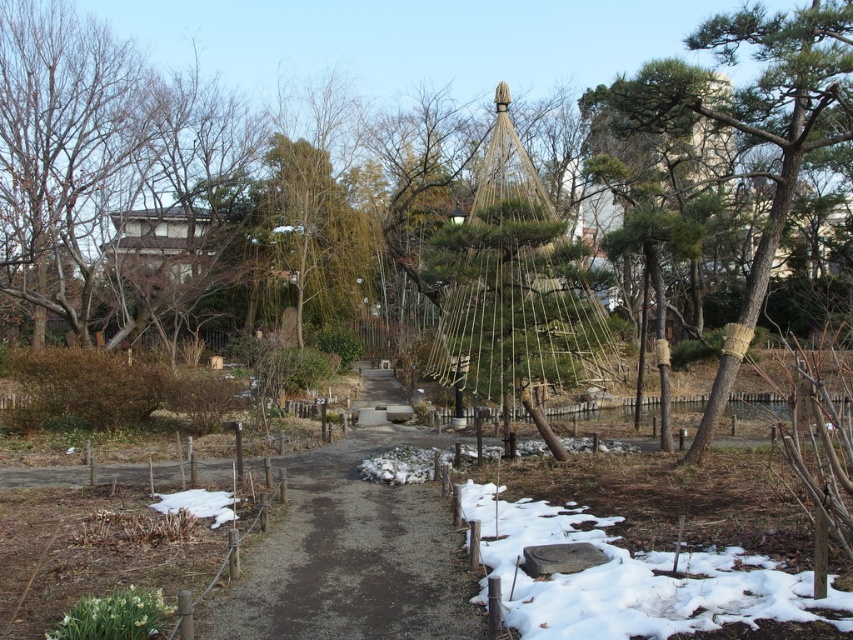
This screenshot has height=640, width=853. What do you see at coordinates (350, 556) in the screenshot?
I see `dirt path at center` at bounding box center [350, 556].

You are a GUI agent. You are given a task and a screenshot of the screen. Output one action in this format:
    pyautogui.click(x=<x>, y=<y>)
    Task: Click on the dirt path at center
    
    Given the screenshot: What is the action you would take?
    pyautogui.click(x=350, y=556)

Who is higher up, dirt path at center or brown rough bark tree at right?

brown rough bark tree at right

Does dirt path at center appear on the left side of brown rough bark tree at right?

Correct, you'll find dirt path at center to the left of brown rough bark tree at right.

Where is `dirt path at center`? The height and width of the screenshot is (640, 853). dirt path at center is located at coordinates (350, 556).

Can you confirm if brown rough bark tree at right is thinner than white powdery snow at lower right?

In fact, brown rough bark tree at right might be wider than white powdery snow at lower right.

Can you confirm if brown rough bark tree at right is positioned to the right of white powdery snow at lower right?

Yes, brown rough bark tree at right is to the right of white powdery snow at lower right.

Where is `brown rough bark tree at right`? The width and height of the screenshot is (853, 640). brown rough bark tree at right is located at coordinates (749, 128).